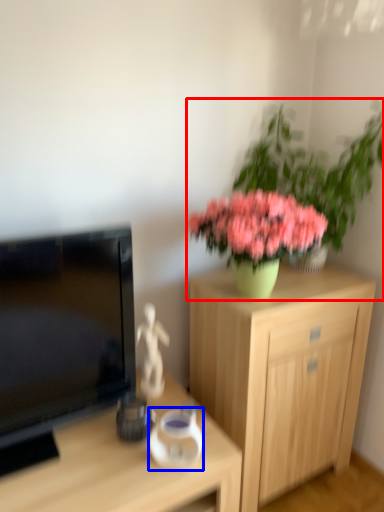
Question: Which point is closer to the camera, houseplant (highlighted by a red box) or vase (highlighted by a blue box)?

Choices:
 (A) houseplant
 (B) vase

Answer: (B)